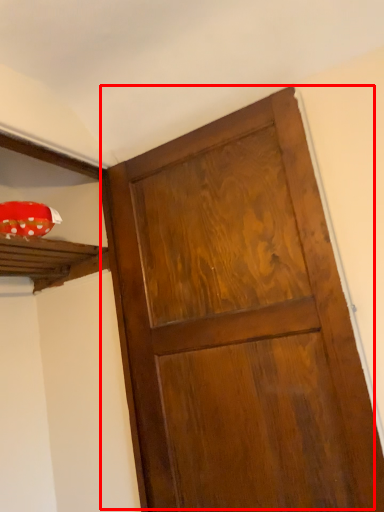
Question: From the image's perspective, what is the correct spatial positioning of door (annotated by the red box) in reference to shelf?

Choices:
 (A) below
 (B) above

Answer: (A)